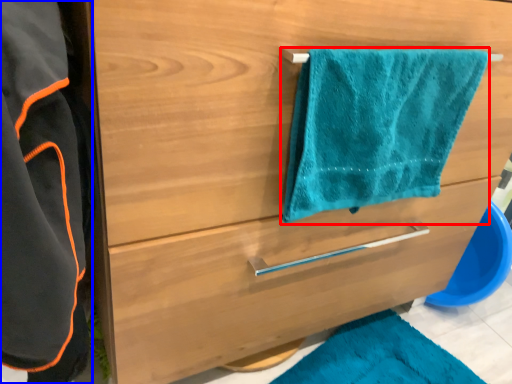
Question: Which object is further to the camera taking this photo, towel/napkin (highlighted by a red box) or bathrobe (highlighted by a blue box)?

Choices:
 (A) towel/napkin
 (B) bathrobe

Answer: (A)